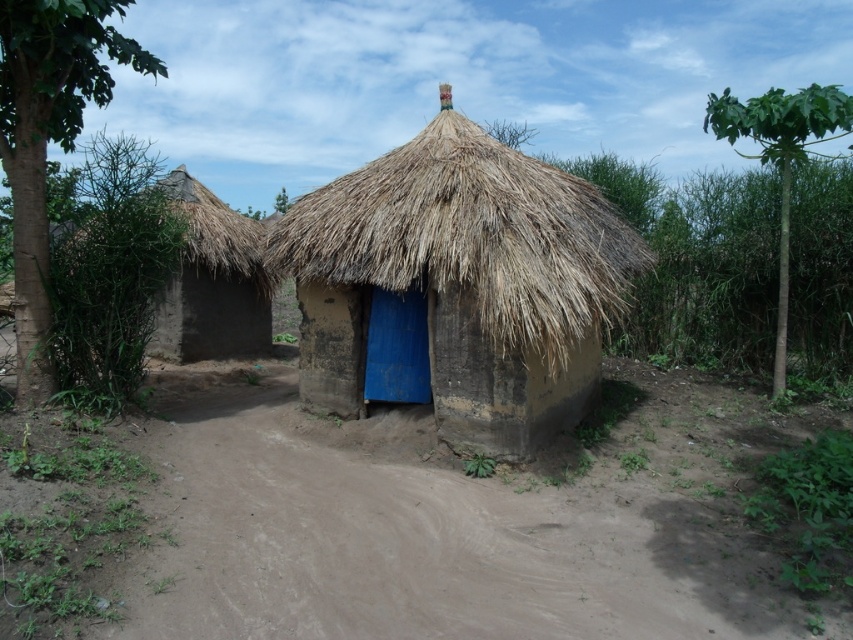
Consider the image. You are a traveler standing on the brown sandy dirt track at lower center and want to reach the thatched straw hut at center. Which direction should you move to get closer to the hut?

The brown sandy dirt track at lower center has a lesser height compared to the thatched straw hut at center, so you should move upward towards the thatched straw hut at center to get closer.

You are standing at the entrance of the blue door hut and want to walk to the brown sandy dirt track at lower center. Which direction should you walk to reach it?

The brown sandy dirt track at lower center is located at coordinates point (461, 525), so you should walk towards the lower center direction to reach it.